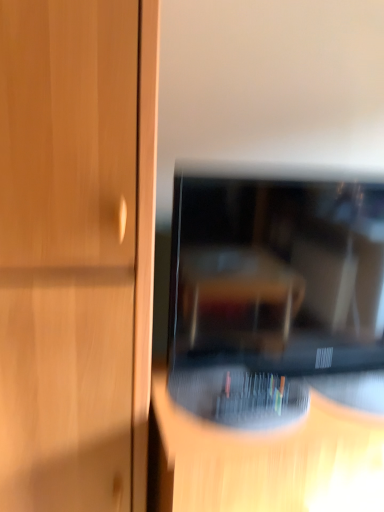
Describe the element at coordinates (277, 273) in the screenshot. I see `black glossy television at center` at that location.

The height and width of the screenshot is (512, 384). Find the location of `black glossy television at center`. black glossy television at center is located at coordinates (277, 273).

You are a GUI agent. You are given a task and a screenshot of the screen. Output one action in this format:
    pyautogui.click(x=<x>, y=<y>)
    Task: Click on the transparent plastic cd case at center
    Image resolution: width=384 pixels, height=512 pixels.
    Given the screenshot: What is the action you would take?
    pyautogui.click(x=265, y=458)

This screenshot has height=512, width=384. Describe the element at coordinates (265, 458) in the screenshot. I see `transparent plastic cd case at center` at that location.

You are a GUI agent. You are given a task and a screenshot of the screen. Output one action in this format:
    pyautogui.click(x=<x>, y=<y>)
    Task: Click on the black glossy television at center
    This screenshot has width=384, height=512.
    Given the screenshot: What is the action you would take?
    pyautogui.click(x=277, y=273)

Does black glossy television at center appear on the left side of transparent plastic cd case at center?

Yes, black glossy television at center is to the left of transparent plastic cd case at center.

Which object is closer to the camera, black glossy television at center or transparent plastic cd case at center?

transparent plastic cd case at center is closer to the camera.

Is point (367, 216) in front of point (263, 483)?

No, it is behind (263, 483).

From the image's perspective, is black glossy television at center positioned above or below transparent plastic cd case at center?

black glossy television at center is above transparent plastic cd case at center.

From a real-world perspective, is black glossy television at center located beneath transparent plastic cd case at center?

No, from a real-world perspective, black glossy television at center is not under transparent plastic cd case at center.

In terms of width, does black glossy television at center look wider or thinner when compared to transparent plastic cd case at center?

Considering their sizes, black glossy television at center looks slimmer than transparent plastic cd case at center.

Between black glossy television at center and transparent plastic cd case at center, which one has less height?

Standing shorter between the two is black glossy television at center.

Is black glossy television at center smaller than transparent plastic cd case at center?

Yes.

From the picture: Is black glossy television at center spatially inside transparent plastic cd case at center, or outside of it?

black glossy television at center lies outside transparent plastic cd case at center.

Does black glossy television at center touch transparent plastic cd case at center?

black glossy television at center and transparent plastic cd case at center are not in contact.

Is black glossy television at center facing towards transparent plastic cd case at center?

No, black glossy television at center is not turned towards transparent plastic cd case at center.

At what (x,y) coordinates should I click in order to perform the action: click on furniture to the right of black glossy television at center. Please return your answer as a coordinate pair (x, y). Looking at the image, I should click on (265, 458).

Can you confirm if transparent plastic cd case at center is positioned to the left of black glossy television at center?

In fact, transparent plastic cd case at center is to the right of black glossy television at center.

Which is behind, transparent plastic cd case at center or black glossy television at center?

black glossy television at center is further away from the camera.

Which point is more distant from viewer, (180,424) or (382,343)?

The point (382,343) is more distant.

From the image's perspective, is transparent plastic cd case at center below black glossy television at center?

Yes, from the image's perspective, transparent plastic cd case at center is below black glossy television at center.

From a real-world perspective, relative to black glossy television at center, is transparent plastic cd case at center vertically above or below?

In terms of real-world spatial position, transparent plastic cd case at center is below black glossy television at center.

Which object is wider, transparent plastic cd case at center or black glossy television at center?

transparent plastic cd case at center is wider.

Between transparent plastic cd case at center and black glossy television at center, which one has more height?

Standing taller between the two is transparent plastic cd case at center.

Looking at the image, does transparent plastic cd case at center seem bigger or smaller compared to black glossy television at center?

transparent plastic cd case at center is bigger than black glossy television at center.

Could black glossy television at center be considered to be inside transparent plastic cd case at center?

No, black glossy television at center is not surrounded by transparent plastic cd case at center.

Is transparent plastic cd case at center far away from black glossy television at center?

transparent plastic cd case at center is actually quite close to black glossy television at center.

Is transparent plastic cd case at center aimed at black glossy television at center?

No, transparent plastic cd case at center is not oriented towards black glossy television at center.

At what (x,y) coordinates should I click in order to perform the action: click on television on the left side of transparent plastic cd case at center. Please return your answer as a coordinate pair (x, y). Looking at the image, I should click on (277, 273).

At what (x,y) coordinates should I click in order to perform the action: click on television behind the transparent plastic cd case at center. Please return your answer as a coordinate pair (x, y). The image size is (384, 512). Looking at the image, I should click on (277, 273).

What are the coordinates of `television on the left of transparent plastic cd case at center` in the screenshot? It's located at (277, 273).